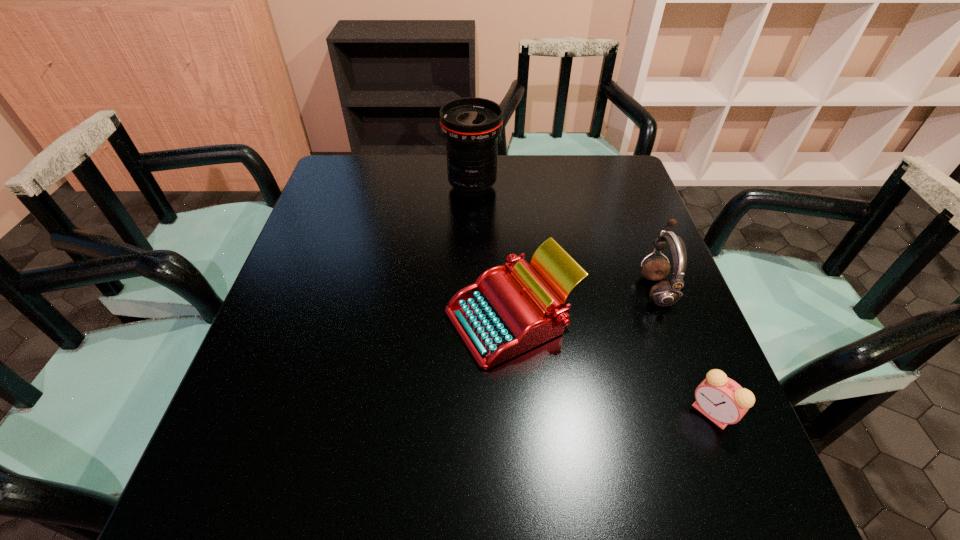
Locate an element on the screen. vacant space located on the typing side of the typewriter is located at coordinates (408, 319).

Locate an element on the screen. The image size is (960, 540). blank space located on the typing side of the typewriter is located at coordinates (272, 319).

Image resolution: width=960 pixels, height=540 pixels. What are the coordinates of `vacant space located 0.190m on the typing side of the typewriter` in the screenshot? It's located at [358, 319].

Image resolution: width=960 pixels, height=540 pixels. I want to click on free space located on the face of the alarm clock, so click(663, 413).

The height and width of the screenshot is (540, 960). I want to click on free spot located 0.280m on the face of the alarm clock, so click(x=540, y=413).

I want to click on vacant area situated 0.150m on the face of the alarm clock, so click(610, 413).

In order to click on object that is at the far edge in this screenshot , I will do `click(471, 126)`.

The height and width of the screenshot is (540, 960). I want to click on earphone present at the right edge, so click(665, 293).

Where is `alarm clock situated at the right edge`? alarm clock situated at the right edge is located at coordinates (721, 399).

The width and height of the screenshot is (960, 540). Identify the location of vacant space at the far edge of the desktop. (540, 160).